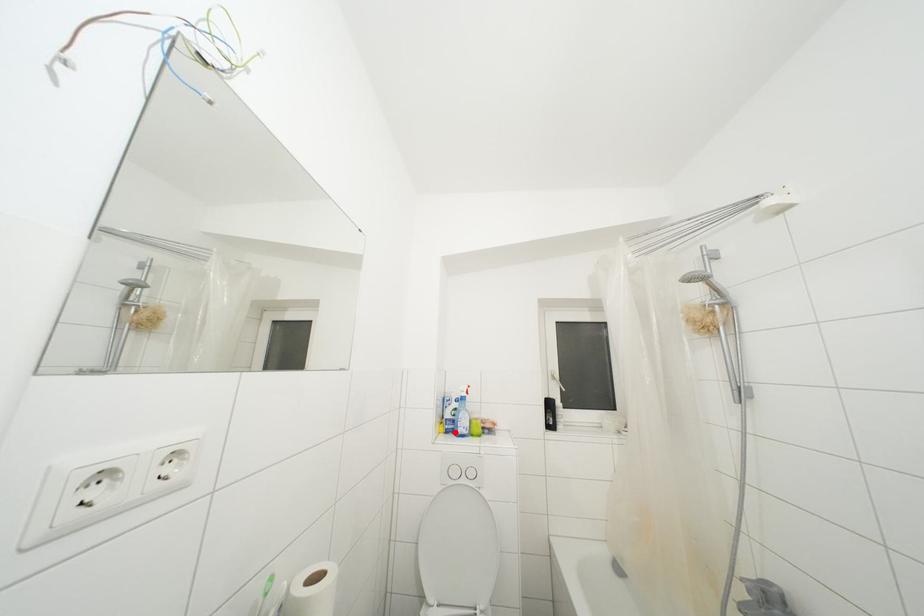
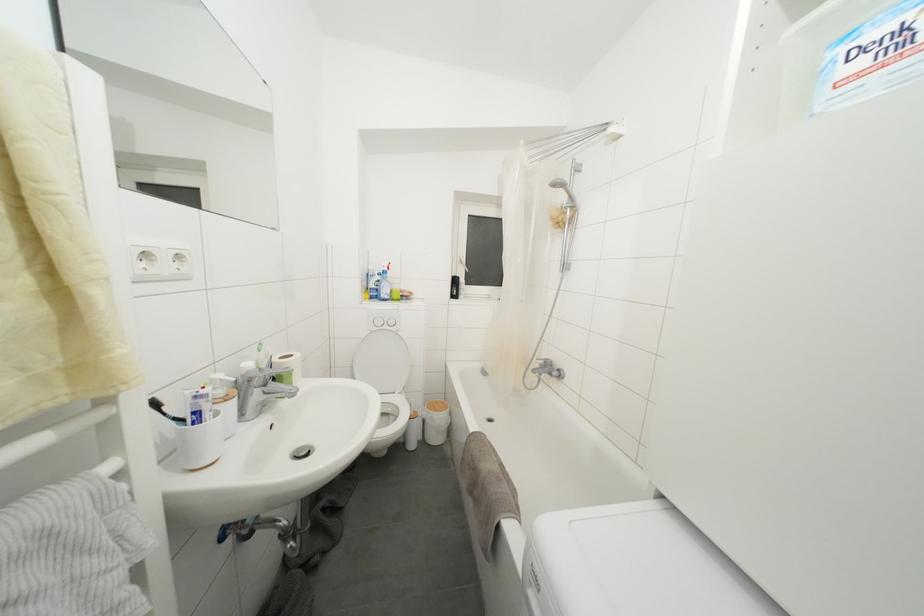
Question: I am providing you with two images of the same scene from different viewpoints. A red point is marked on the first image. Can you still see the location of the red point in image 2?

Choices:
 (A) Yes
 (B) No

Answer: (A)